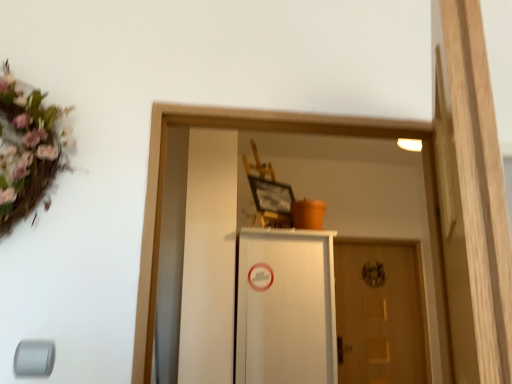
Question: In the image, is white matte cabinet at center positioned in front of or behind wooden door at center?

Choices:
 (A) front
 (B) behind

Answer: (A)

Question: Looking at the image, does white matte cabinet at center seem bigger or smaller compared to wooden door at center?

Choices:
 (A) small
 (B) big

Answer: (B)

Question: Considering the positions of white matte cabinet at center and wooden door at center in the image, is white matte cabinet at center wider or thinner than wooden door at center?

Choices:
 (A) thin
 (B) wide

Answer: (B)

Question: From their relative heights in the image, would you say wooden door at center is taller or shorter than white matte cabinet at center?

Choices:
 (A) tall
 (B) short

Answer: (A)

Question: Choose the correct answer: Is wooden door at center inside white matte cabinet at center or outside it?

Choices:
 (A) inside
 (B) outside

Answer: (B)

Question: Is wooden door at center to the left or to the right of white matte cabinet at center in the image?

Choices:
 (A) left
 (B) right

Answer: (B)

Question: Considering their positions, is wooden door at center located in front of or behind white matte cabinet at center?

Choices:
 (A) front
 (B) behind

Answer: (B)